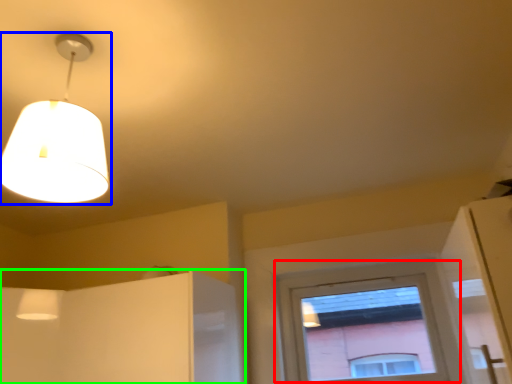
Question: Which object is the closest to the window (highlighted by a red box)? Choose among these: lamp (highlighted by a blue box) or cabinetry (highlighted by a green box).

Choices:
 (A) lamp
 (B) cabinetry

Answer: (B)